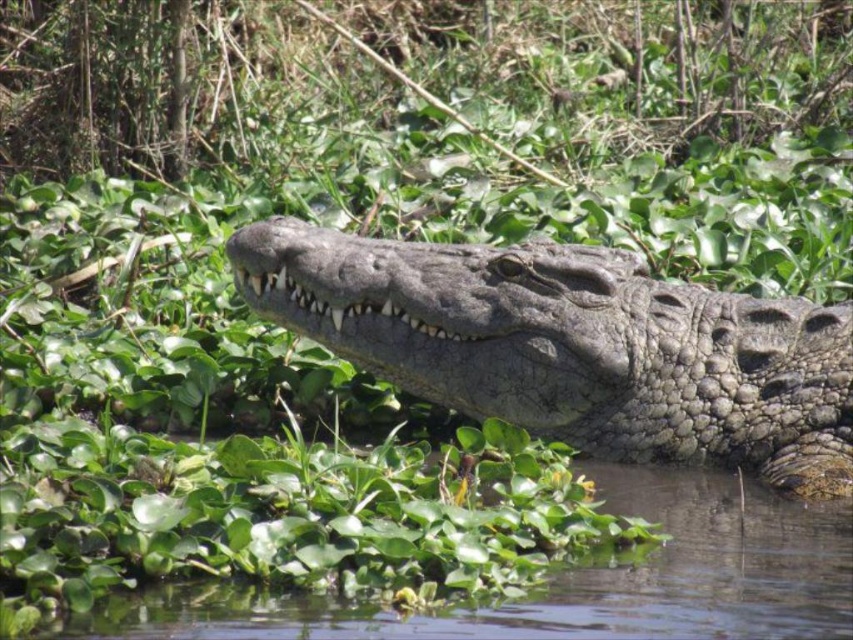
You are a wildlife photographer aiming to capture a close shot of the crocodile. You have a camera with a zoom lens that can focus on a specific point. If you aim your camera at point (x=573, y=346), will you be able to get a clear photo of the crocodile?

Yes, because the rough textured crocodile at center is exactly located at point (x=573, y=346), so focusing there will capture it clearly.

You are a wildlife photographer aiming to capture the crocodile in the center. Given that your camera can focus on objects within a 0.5 radius from the center point of the image, which is at coordinates 0.5,0.5, will the rough textured crocodile at center be within your camera focus range?

The rough textured crocodile at center is located at coordinates (573,346). The distance from the center point (426,320) to this position is calculated using the Euclidean distance formula. The distance squared would be 0.001764 plus 0.007024, totaling 0.008788. The square root of this value is approximately 0.0937, which is less than 0.5. Therefore, the rough textured crocodile at center is within the camera focus range.

You are a wildlife photographer aiming to capture a close shot of the rough textured crocodile at center. Since you are in a boat, you need to know if the crocodile is above or below the clear water at center. Can you tell me?

The rough textured crocodile at center is located above the clear water at center, so it is above the water.